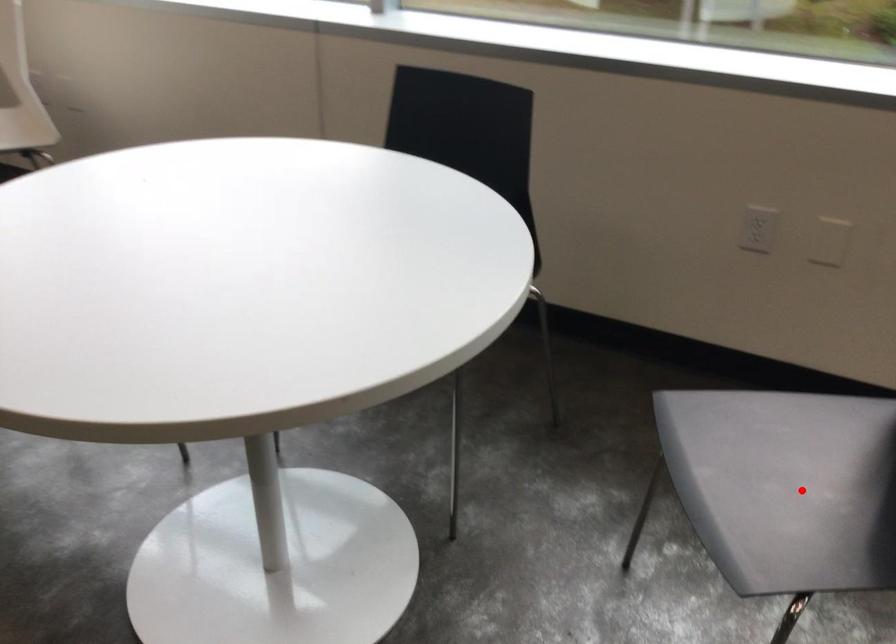
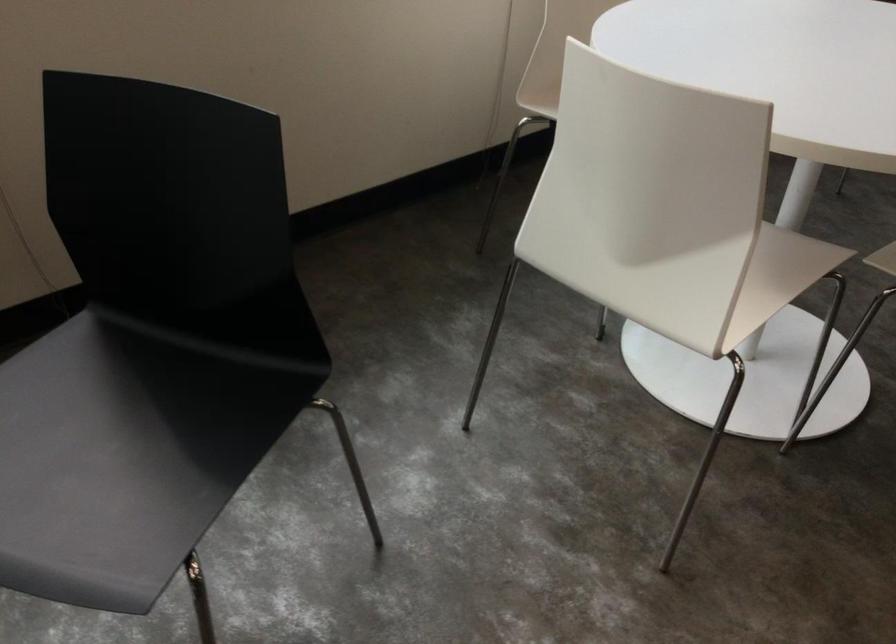
Question: I am providing you with two images of the same scene from different viewpoints. A red point is shown in image1. For the corresponding object point in image2, is it positioned nearer or farther from the camera?

Choices:
 (A) Nearer
 (B) Farther

Answer: (A)